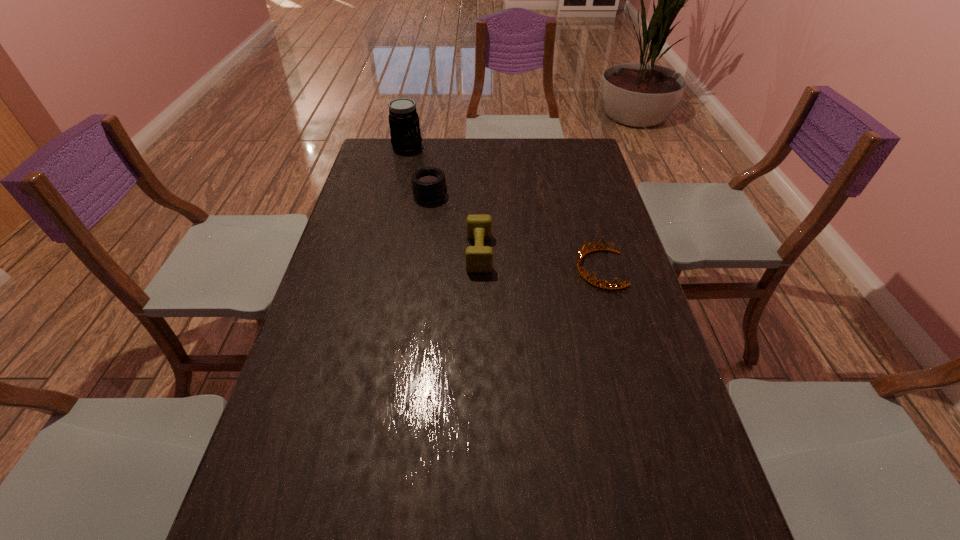
Where is `the farther telephoto lens`? The image size is (960, 540). the farther telephoto lens is located at coordinates tap(405, 133).

Where is `the taller telephoto lens`? the taller telephoto lens is located at coordinates (405, 133).

Where is `dumbbell`? The image size is (960, 540). dumbbell is located at coordinates (479, 259).

You are a GUI agent. You are given a task and a screenshot of the screen. Output one action in this format:
    pyautogui.click(x=<x>, y=<y>)
    Task: Click on the shorter telephoto lens
    This screenshot has width=960, height=540.
    Given the screenshot: What is the action you would take?
    pyautogui.click(x=428, y=184)

Identify the location of the nearer telephoto lens. pos(428,184).

Image resolution: width=960 pixels, height=540 pixels. I want to click on the rightmost object, so click(x=580, y=255).

I want to click on vacant space located on the right of the farther telephoto lens, so click(x=465, y=147).

You are a GUI agent. You are given a task and a screenshot of the screen. Output one action in this format:
    pyautogui.click(x=<x>, y=<y>)
    Task: Click on the vacant point located 0.380m on the front of the dumbbell
    
    Given the screenshot: What is the action you would take?
    pyautogui.click(x=479, y=390)

What are the coordinates of `blank space located on the side of the shorter telephoto lens with brand markings and control switches` in the screenshot? It's located at (540, 195).

You are a GUI agent. You are given a task and a screenshot of the screen. Output one action in this format:
    pyautogui.click(x=<x>, y=<y>)
    Task: Click on the free space located 0.270m on the front-facing side of the tiara
    This screenshot has width=960, height=540.
    Given the screenshot: What is the action you would take?
    pyautogui.click(x=482, y=269)